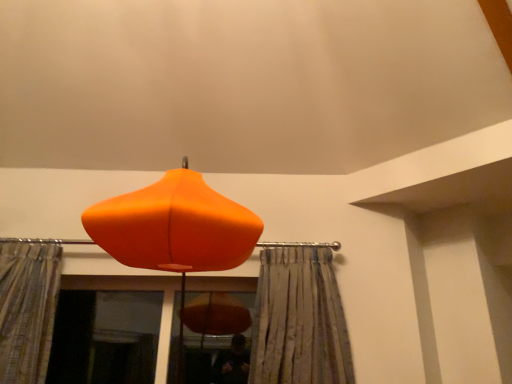
Question: From a real-world perspective, is transparent glass screen door at lower left positioned above or below silky gray curtain at center, the first curtain when ordered from right to left?

Choices:
 (A) below
 (B) above

Answer: (A)

Question: Does point (111, 377) appear closer or farther from the camera than point (292, 246)?

Choices:
 (A) farther
 (B) closer

Answer: (A)

Question: Based on their relative distances, which object is nearer to the textured beige curtain at left, which appears as the 1th curtain when viewed from the left?

Choices:
 (A) silky gray curtain at center, the first curtain when ordered from right to left
 (B) orange matte lampshade at center
 (C) transparent glass screen door at lower left

Answer: (B)

Question: Estimate the real-world distances between objects in this image. Which object is farther from the orange matte lampshade at center?

Choices:
 (A) textured beige curtain at left, the second curtain positioned from the right
 (B) silky gray curtain at center, the first curtain when ordered from right to left
 (C) transparent glass screen door at lower left

Answer: (C)